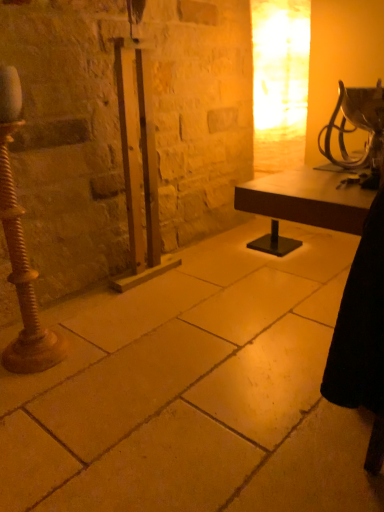
Question: Can you confirm if rusty metal pole at left is thinner than smooth stone floor at center?

Choices:
 (A) yes
 (B) no

Answer: (A)

Question: Is rusty metal pole at left shorter than smooth stone floor at center?

Choices:
 (A) yes
 (B) no

Answer: (B)

Question: Considering the relative positions of rusty metal pole at left and smooth stone floor at center in the image provided, is rusty metal pole at left in front of smooth stone floor at center?

Choices:
 (A) no
 (B) yes

Answer: (A)

Question: From a real-world perspective, does rusty metal pole at left stand above smooth stone floor at center?

Choices:
 (A) yes
 (B) no

Answer: (A)

Question: Is rusty metal pole at left taller than smooth stone floor at center?

Choices:
 (A) yes
 (B) no

Answer: (A)

Question: Is rusty metal pole at left bigger than smooth stone floor at center?

Choices:
 (A) no
 (B) yes

Answer: (A)

Question: Is rusty metal pole at left looking in the opposite direction of metallic silver table lamp at upper right?

Choices:
 (A) no
 (B) yes

Answer: (A)

Question: Considering the relative sizes of rusty metal pole at left and metallic silver table lamp at upper right in the image provided, is rusty metal pole at left smaller than metallic silver table lamp at upper right?

Choices:
 (A) no
 (B) yes

Answer: (A)

Question: From the image's perspective, is rusty metal pole at left under metallic silver table lamp at upper right?

Choices:
 (A) yes
 (B) no

Answer: (A)

Question: From a real-world perspective, does rusty metal pole at left stand above metallic silver table lamp at upper right?

Choices:
 (A) yes
 (B) no

Answer: (B)

Question: From the image's perspective, does rusty metal pole at left appear higher than metallic silver table lamp at upper right?

Choices:
 (A) yes
 (B) no

Answer: (B)

Question: Is rusty metal pole at left wider than metallic silver table lamp at upper right?

Choices:
 (A) yes
 (B) no

Answer: (B)

Question: Considering the relative positions of smooth stone floor at center and metallic silver table lamp at upper right in the image provided, is smooth stone floor at center in front of metallic silver table lamp at upper right?

Choices:
 (A) no
 (B) yes

Answer: (B)